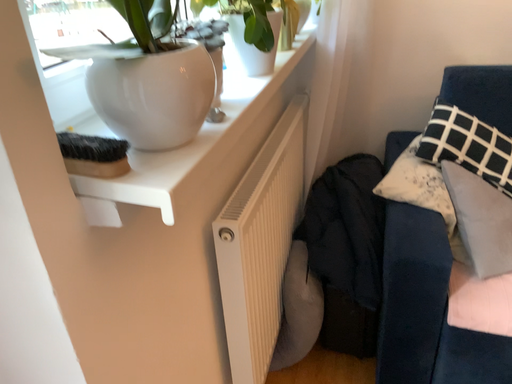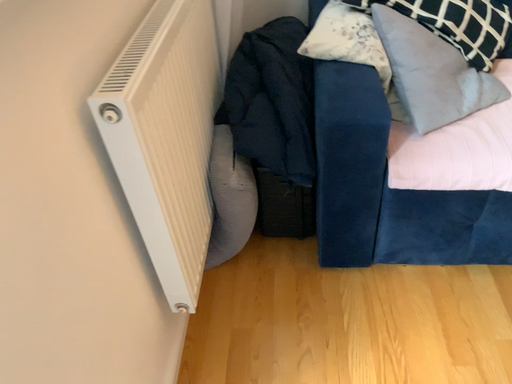
Question: How did the camera likely rotate when shooting the video?

Choices:
 (A) rotated left
 (B) rotated right

Answer: (B)